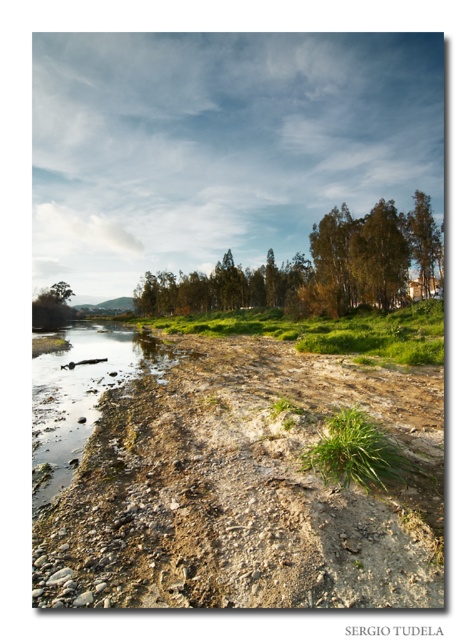
You are a hiker planning to cross the river using the dry, rocky path. You need to know if the green leafy grass at center is narrower than the green leafy tree at upper left. Can you confirm this?

The green leafy grass at center is narrower than the green leafy tree at upper left, so yes, the grass is narrower than the tree.

You are a hiker who wants to take a photo of the brown rough dirt field at lower left and the green leafy tree at upper center. Which object should you focus on first if you want to capture both in a single frame without moving the camera?

You should focus on the green leafy tree at upper center first because it occupies more space in the image than the brown rough dirt field at lower left, so it will be easier to frame both objects by centering the larger one first.

Based on the photo, you are standing at the starting point of the dry rocky path in the foreground. You see a point marked at coordinates (330, 330). What is the terrain like at that point?

The point at coordinates (330, 330) corresponds to a green grassy patch at center, which is likely softer and less rocky than the dry, rocky path you are currently on.